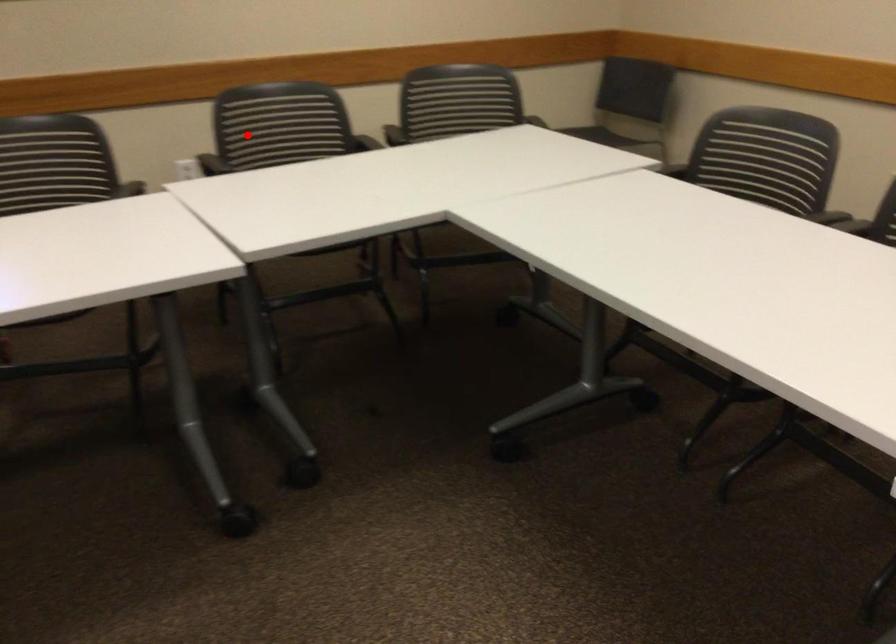
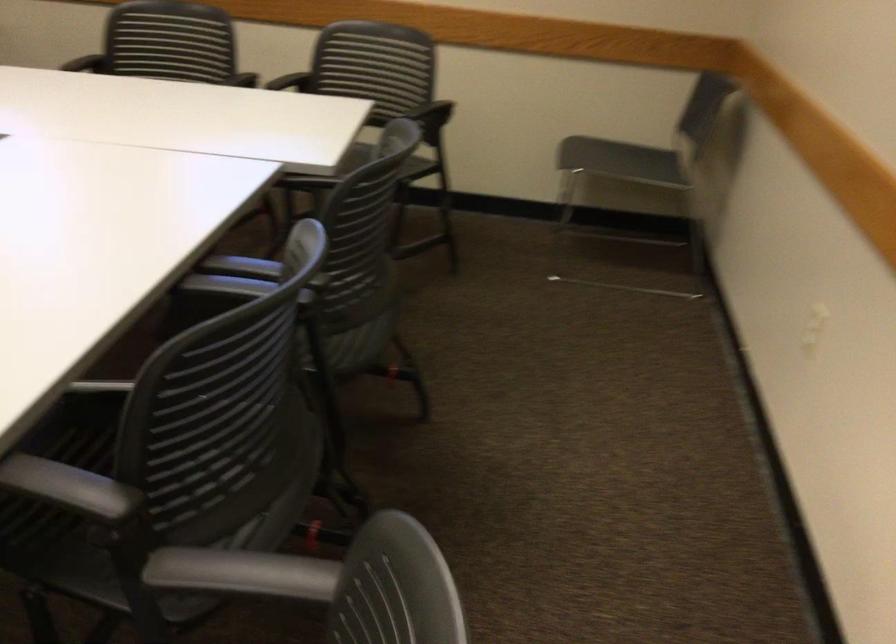
Question: I am providing you with two images of the same scene from different viewpoints. A red point is marked on the first image. Can you still see the location of the red point in image 2?

Choices:
 (A) Yes
 (B) No

Answer: (A)